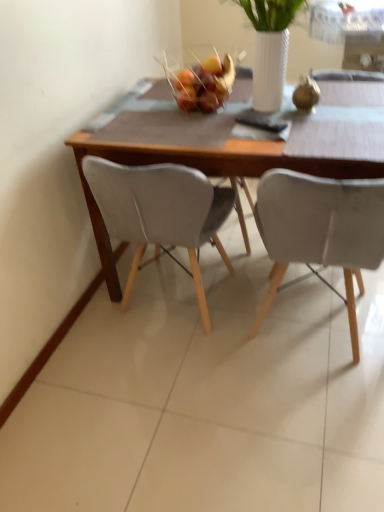
Question: From a real-world perspective, is glossy plastic fruit basket at center beneath wooden table at center?

Choices:
 (A) no
 (B) yes

Answer: (A)

Question: Is glossy plastic fruit basket at center bigger than wooden table at center?

Choices:
 (A) no
 (B) yes

Answer: (A)

Question: Is the position of glossy plastic fruit basket at center more distant than that of wooden table at center?

Choices:
 (A) yes
 (B) no

Answer: (A)

Question: Considering the relative sizes of glossy plastic fruit basket at center and wooden table at center in the image provided, is glossy plastic fruit basket at center smaller than wooden table at center?

Choices:
 (A) no
 (B) yes

Answer: (B)

Question: Can you see glossy plastic fruit basket at center touching wooden table at center?

Choices:
 (A) yes
 (B) no

Answer: (B)

Question: Is glossy plastic fruit basket at center oriented towards wooden table at center?

Choices:
 (A) yes
 (B) no

Answer: (B)

Question: Is matte gray chair at center, marked as the 2th chair in a right-to-left arrangement, aimed at glossy plastic fruit basket at center?

Choices:
 (A) no
 (B) yes

Answer: (A)

Question: Considering the relative sizes of matte gray chair at center, placed as the first chair when sorted from left to right, and glossy plastic fruit basket at center in the image provided, is matte gray chair at center, placed as the first chair when sorted from left to right, thinner than glossy plastic fruit basket at center?

Choices:
 (A) no
 (B) yes

Answer: (A)

Question: Is matte gray chair at center, marked as the 2th chair in a right-to-left arrangement, positioned in front of glossy plastic fruit basket at center?

Choices:
 (A) no
 (B) yes

Answer: (B)

Question: Considering the relative sizes of matte gray chair at center, marked as the 2th chair in a right-to-left arrangement, and glossy plastic fruit basket at center in the image provided, is matte gray chair at center, marked as the 2th chair in a right-to-left arrangement, bigger than glossy plastic fruit basket at center?

Choices:
 (A) yes
 (B) no

Answer: (A)

Question: Does matte gray chair at center, placed as the first chair when sorted from left to right, have a smaller size compared to glossy plastic fruit basket at center?

Choices:
 (A) yes
 (B) no

Answer: (B)

Question: Is glossy plastic fruit basket at center completely or partially inside matte gray chair at center, marked as the 2th chair in a right-to-left arrangement?

Choices:
 (A) yes
 (B) no

Answer: (B)

Question: Is wooden table at center far from glossy plastic fruit basket at center?

Choices:
 (A) no
 (B) yes

Answer: (A)